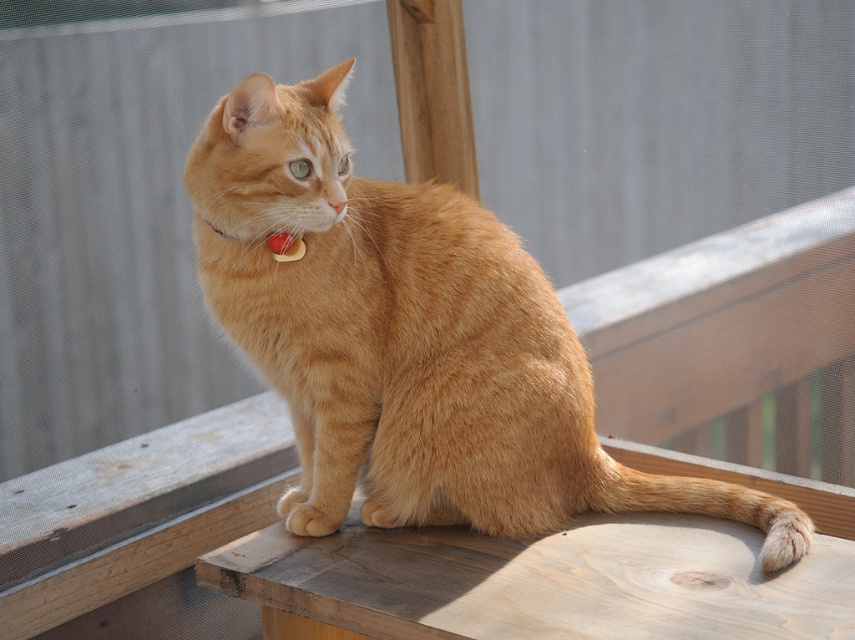
From the picture: You are a veterinarian examining a cat and its collar. Based on the image, is the orange fur cat at center larger than the red plastic collar at center?

Yes, the orange fur cat at center is bigger than the red plastic collar at center according to the description.

You are a photographer trying to capture the orange fur cat at center and the red plastic collar at center in a single shot. Which object should you adjust your camera to focus on first if you want to ensure both are in frame?

The orange fur cat at center is positioned on the right side of the red plastic collar at center, so you should focus on the red plastic collar at center first to ensure both are in frame.